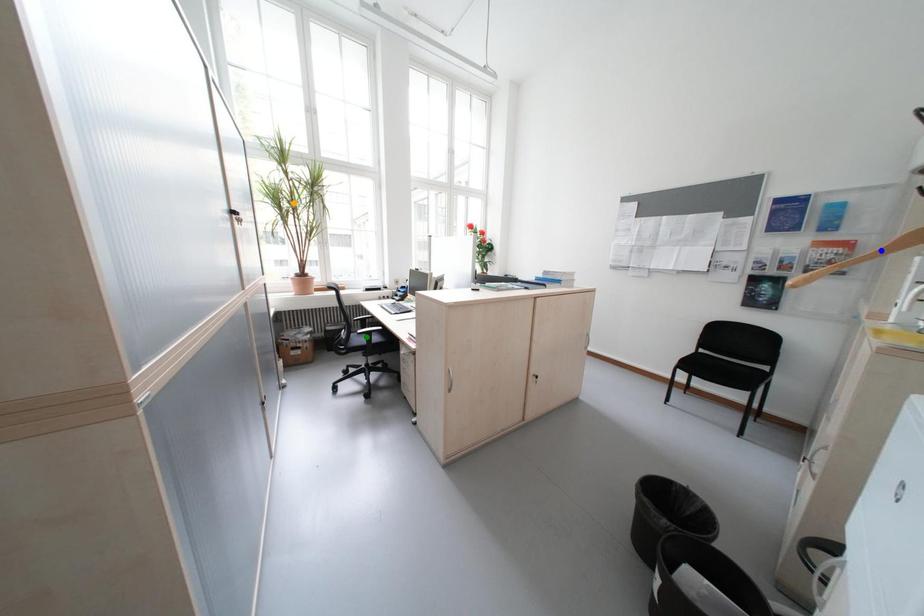
Order these from nearest to farthest:
1. orange point
2. blue point
3. green point

blue point
green point
orange point